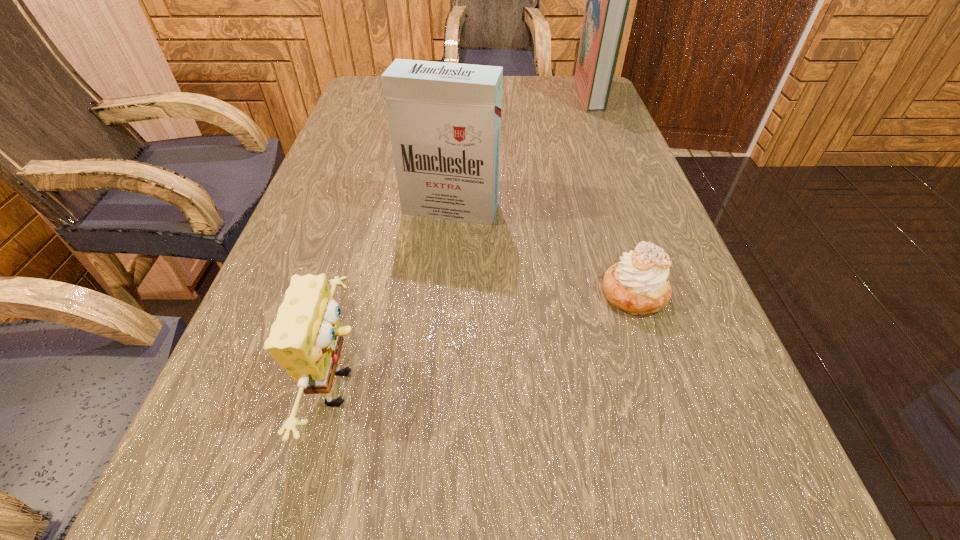
You are a GUI agent. You are given a task and a screenshot of the screen. Output one action in this format:
    pyautogui.click(x=<x>, y=<y>)
    Task: Click on the free location located on the cover of the tallest object
    Image resolution: width=960 pixels, height=540 pixels.
    Given the screenshot: What is the action you would take?
    pyautogui.click(x=544, y=93)

Locate an element on the screen. The image size is (960, 540). vacant area situated 0.280m on the right of the cigarette case is located at coordinates (632, 209).

At what (x,y) coordinates should I click in order to perform the action: click on vacant space situated 0.070m on the face of the third tallest object. Please return your answer as a coordinate pair (x, y). Looking at the image, I should click on (420, 387).

Identify the location of vacant space located 0.330m on the back of the shortest object. Image resolution: width=960 pixels, height=540 pixels. (594, 171).

Where is `object that is at the far edge`? object that is at the far edge is located at coordinates (607, 0).

Where is `object that is at the left edge`? Image resolution: width=960 pixels, height=540 pixels. object that is at the left edge is located at coordinates (306, 339).

Locate an element on the screen. The height and width of the screenshot is (540, 960). hardback book located in the right edge section of the desktop is located at coordinates (607, 0).

You are a GUI agent. You are given a task and a screenshot of the screen. Output one action in this format:
    pyautogui.click(x=<x>, y=<y>)
    Task: Click on the pastry situated at the right edge
    
    Given the screenshot: What is the action you would take?
    pyautogui.click(x=639, y=284)

Where is `object at the far right corner`? object at the far right corner is located at coordinates (607, 0).

This screenshot has height=540, width=960. I want to click on vacant space at the far edge, so click(536, 94).